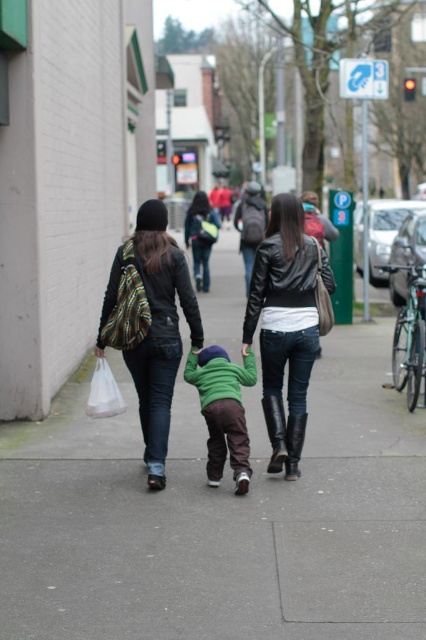
The image size is (426, 640). Identify the location of matte black jacket at left. 152,326.

Can you confirm if matte black jacket at left is smaller than green matte sweater at center?

Result: Actually, matte black jacket at left might be larger than green matte sweater at center.

Which is behind, point (158, 410) or point (212, 394)?

Positioned behind is point (158, 410).

Where is `matte black jacket at left`? The image size is (426, 640). matte black jacket at left is located at coordinates (152, 326).

Does gray concrete sidewalk at center appear under matte black jacket at left?

Yes, gray concrete sidewalk at center is below matte black jacket at left.

Does gray concrete sidewalk at center have a smaller size compared to matte black jacket at left?

No, gray concrete sidewalk at center is not smaller than matte black jacket at left.

What do you see at coordinates (219, 516) in the screenshot?
I see `gray concrete sidewalk at center` at bounding box center [219, 516].

At what (x,y) coordinates should I click in order to perform the action: click on gray concrete sidewalk at center. Please return your answer as a coordinate pair (x, y). The image size is (426, 640). Looking at the image, I should click on (219, 516).

Is gray concrete sidewalk at center below green matte sweater at center?

No, gray concrete sidewalk at center is not below green matte sweater at center.

Which is below, gray concrete sidewalk at center or green matte sweater at center?

green matte sweater at center is lower down.

Does point (118, 502) come closer to viewer compared to point (233, 420)?

Yes, it is.

Image resolution: width=426 pixels, height=640 pixels. I want to click on gray concrete sidewalk at center, so click(219, 516).